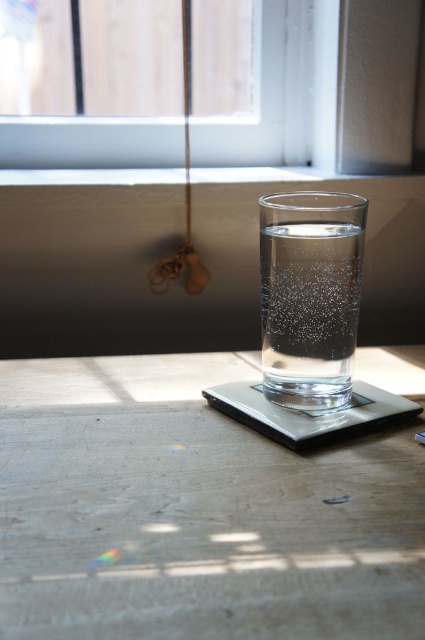
Does transparent glass table at center appear under clear glass water at center?

Yes, transparent glass table at center is below clear glass water at center.

This screenshot has width=425, height=640. What do you see at coordinates (195, 513) in the screenshot? I see `transparent glass table at center` at bounding box center [195, 513].

Measure the distance between transparent glass table at center and camera.

5.82 inches

Locate an element on the screen. The image size is (425, 640). transparent glass table at center is located at coordinates (195, 513).

Can you confirm if transparent glass window at upper center is smaller than clear glass water at center?

No, transparent glass window at upper center is not smaller than clear glass water at center.

Locate an element on the screen. This screenshot has height=640, width=425. transparent glass window at upper center is located at coordinates [277, 92].

Consider the image. Between transparent glass table at center and transparent glass window at upper center, which one appears on the right side from the viewer's perspective?

Positioned to the right is transparent glass table at center.

Measure the distance between transparent glass table at center and camera.

transparent glass table at center and camera are 5.82 inches apart.

What do you see at coordinates (195, 513) in the screenshot?
I see `transparent glass table at center` at bounding box center [195, 513].

Where is `transparent glass table at center`? The width and height of the screenshot is (425, 640). transparent glass table at center is located at coordinates (195, 513).